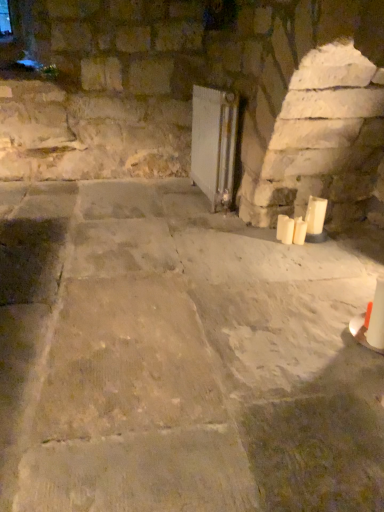
Question: From the image's perspective, is white matte candle at lower right, the second candle positioned from the right, located above or below white matte candle at right, the third candle positioned from the right?

Choices:
 (A) below
 (B) above

Answer: (A)

Question: From a real-world perspective, is white matte candle at lower right, the second candle positioned from the right, above or below white matte candle at right, which is the 1th candle from left to right?

Choices:
 (A) below
 (B) above

Answer: (A)

Question: Which object is the farthest from the white matte candle at right, the first candle when ordered from right to left?

Choices:
 (A) white matte candle at right, the third candle positioned from the right
 (B) white matte candle at lower right, the second candle in the left-to-right sequence
 (C) white glossy radiator at center

Answer: (C)

Question: Which object is the farthest from the white matte candle at lower right, the second candle in the left-to-right sequence?

Choices:
 (A) white matte candle at right, the third candle positioned from the right
 (B) white glossy radiator at center
 (C) white matte candle at right, which is counted as the third candle, starting from the left

Answer: (B)